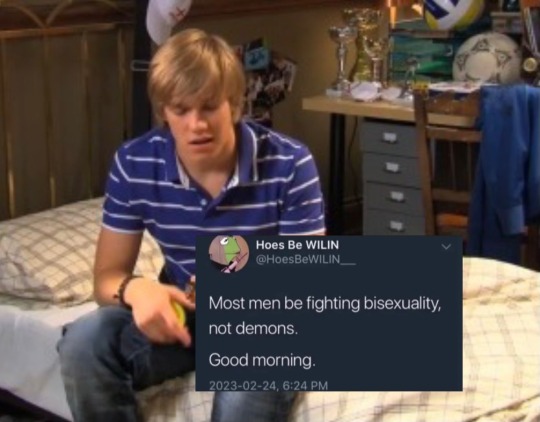
What are the coordinates of `headboard railing` in the screenshot? It's located at (10, 169), (52, 173), (75, 29), (43, 30), (90, 163).